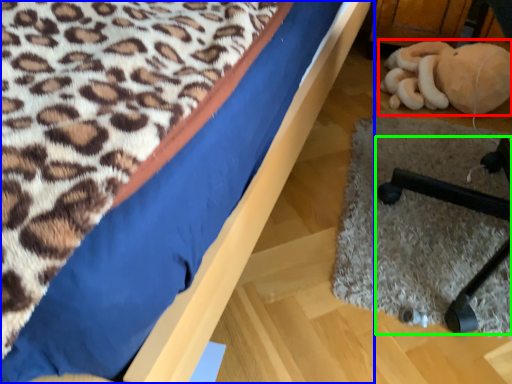
Question: Which object is positioned farthest from toy (highlighted by a red box)? Select from bed (highlighted by a blue box) and furniture (highlighted by a green box).

Choices:
 (A) bed
 (B) furniture

Answer: (A)